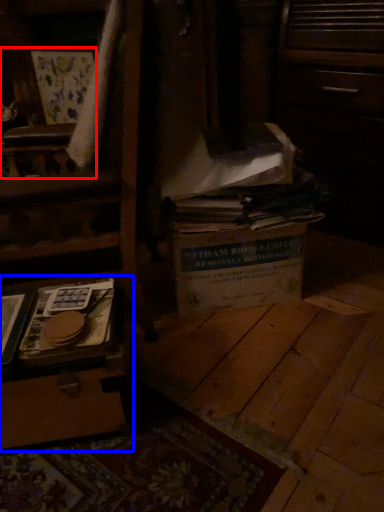
Question: Which of the following is the closest to the observer, armchair (highlighted by a red box) or vanity (highlighted by a blue box)?

Choices:
 (A) armchair
 (B) vanity

Answer: (B)